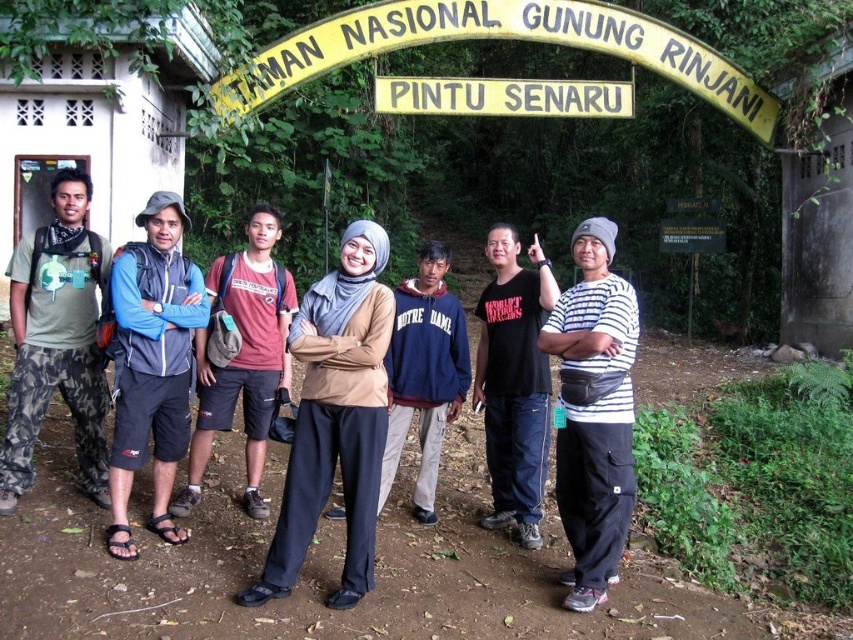
Image resolution: width=853 pixels, height=640 pixels. Find the location of `black matte shirt at center`. black matte shirt at center is located at coordinates (514, 381).

Is point (519, 536) closer to viewer compared to point (613, 113)?

That is True.

Locate an element on the screen. This screenshot has width=853, height=640. black matte shirt at center is located at coordinates (514, 381).

Does striped cotton shirt at center appear over blue fabric jacket at center?

Incorrect, striped cotton shirt at center is not positioned above blue fabric jacket at center.

Which is more to the left, striped cotton shirt at center or blue fabric jacket at center?

blue fabric jacket at center is more to the left.

Is point (618, 477) farther from camera compared to point (173, 232)?

No, it is in front of (173, 232).

Find the location of a particular element. striped cotton shirt at center is located at coordinates (593, 412).

Which is more to the left, camouflage fabric pants at left or black matte shirt at center?

Positioned to the left is camouflage fabric pants at left.

Which is above, camouflage fabric pants at left or black matte shirt at center?

black matte shirt at center is higher up.

What do you see at coordinates (57, 340) in the screenshot? I see `camouflage fabric pants at left` at bounding box center [57, 340].

Image resolution: width=853 pixels, height=640 pixels. What are the coordinates of `camouflage fabric pants at left` in the screenshot? It's located at (57, 340).